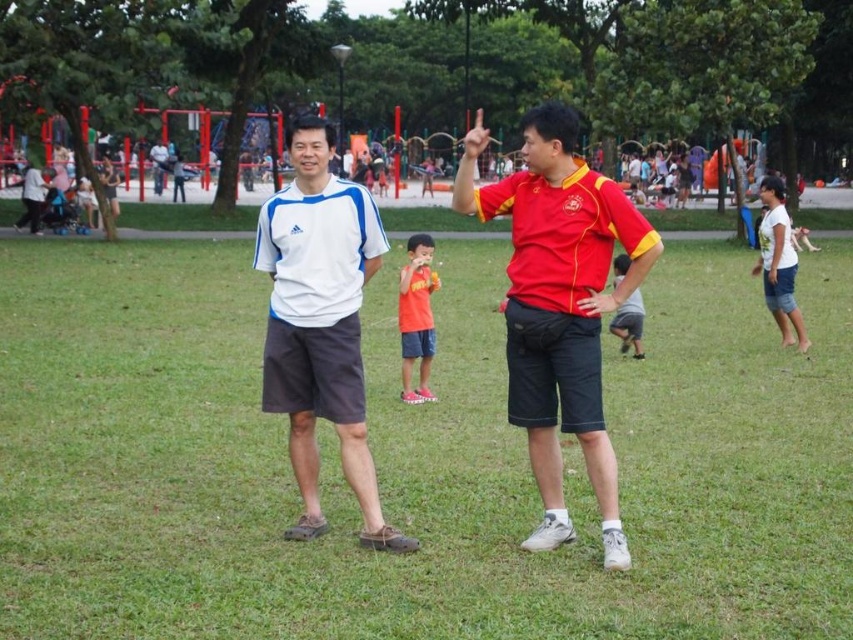
You are a photographer trying to capture both the matte red shirt at center and the orange matte shirt at center in a single frame. Which shirt should you focus on first to ensure both are in the frame?

The matte red shirt at center is larger in size than the orange matte shirt at center, so you should focus on the matte red shirt at center first to ensure both are in the frame.

You are standing at the point with coordinates point [421,294] and want to move to the point with coordinates point [512,412]. Is the destination point in front of or behind your current position?

The point [512,412] is in front of point [421,294], so the destination point is in front of your current position.